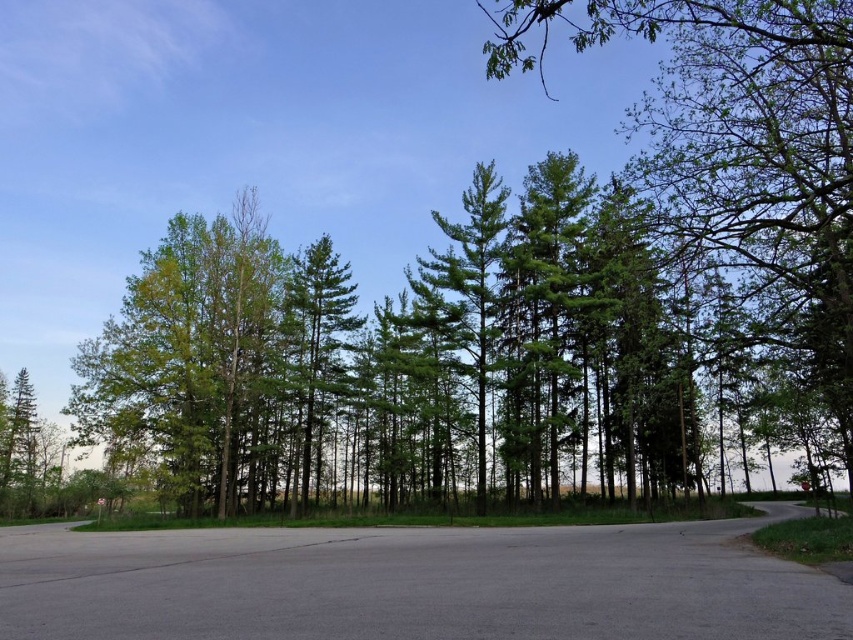
You are a hiker standing at the starting point of the road. You want to walk to the green pine tree at center. However, there is a green matte tree at upper right blocking your path. Can you walk around it to reach your destination?

The green matte tree at upper right and green pine tree at center are 24.67 meters apart. Since the distance between them is sufficient, you can walk around the green matte tree at upper right to reach the green pine tree at center.